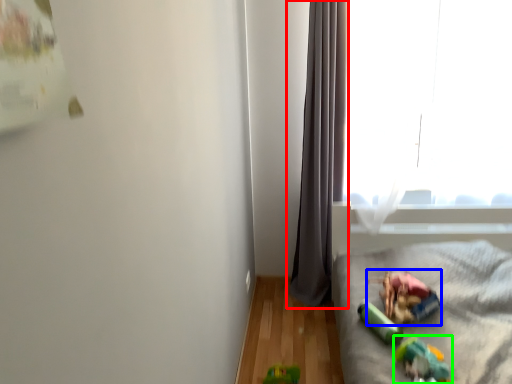
Question: Based on their relative distances, which object is farther from curtain (highlighted by a red box)? Choose from stuff (highlighted by a blue box) and toy (highlighted by a green box).

Choices:
 (A) stuff
 (B) toy

Answer: (B)